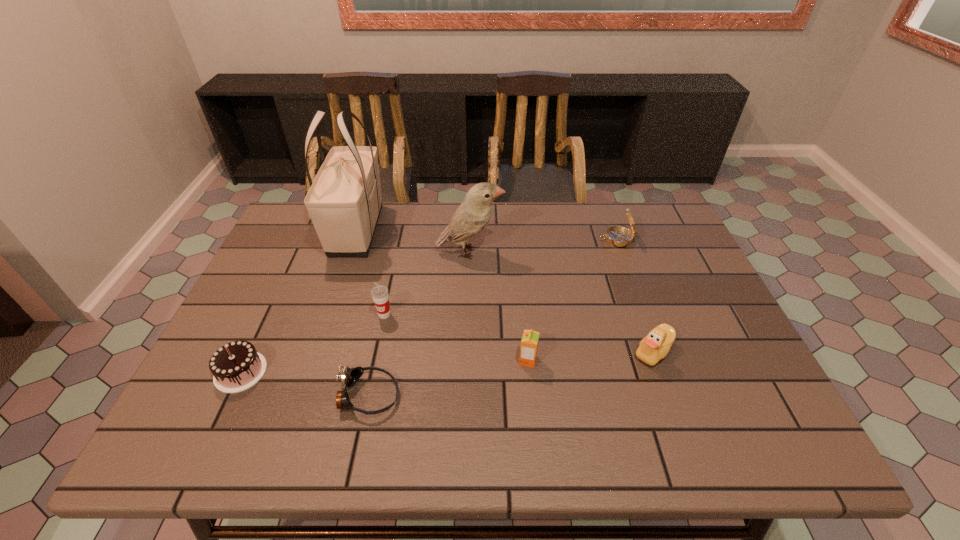
Image resolution: width=960 pixels, height=540 pixels. I want to click on object at the far right corner, so click(618, 236).

Identify the location of free space at the far edge of the desktop. (407, 232).

Locate an element on the screen. vacant position at the near edge of the desktop is located at coordinates (561, 429).

Image resolution: width=960 pixels, height=540 pixels. Identify the location of vacant space at the left edge of the desktop. (203, 403).

This screenshot has height=540, width=960. In the image, there is a desktop. Find the location of `blank space at the right edge`. blank space at the right edge is located at coordinates (714, 319).

Locate an element on the screen. The image size is (960, 540). free region at the far left corner of the desktop is located at coordinates (305, 220).

At what (x,y) coordinates should I click in order to perform the action: click on vacant space at the far right corner of the desktop. Please return your answer as a coordinate pair (x, y). Looking at the image, I should click on (661, 239).

At what (x,y) coordinates should I click in order to perform the action: click on free spot between the leftmost object and the bird. Please return your answer as a coordinate pair (x, y). Looking at the image, I should click on (355, 312).

The width and height of the screenshot is (960, 540). Find the location of `free spot between the cup and the seventh shortest object`. free spot between the cup and the seventh shortest object is located at coordinates (427, 284).

Locate an element on the screen. The height and width of the screenshot is (540, 960). empty space between the duck and the orange juice is located at coordinates (590, 356).